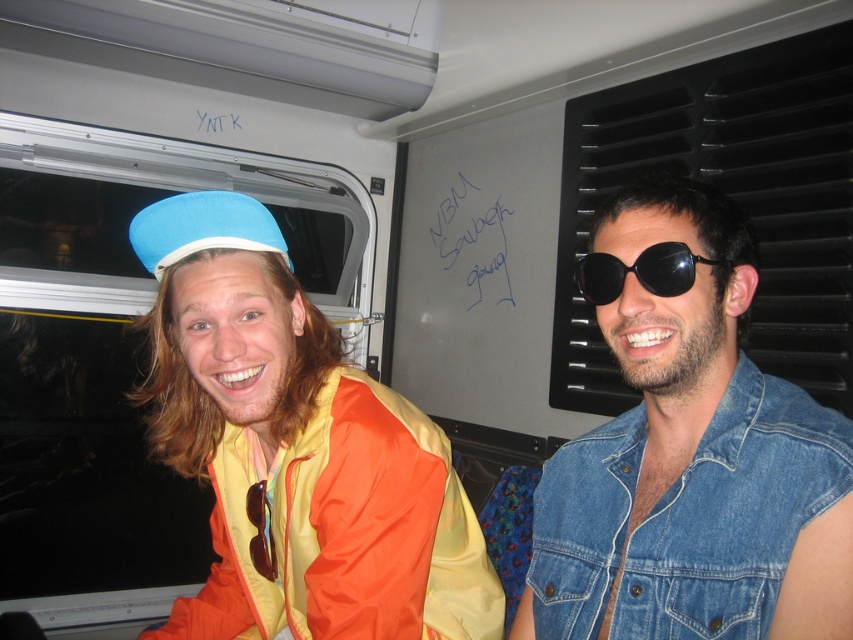
You are a passenger in the vehicle and need to locate the exact position of the point with coordinates (296, 449). Based on the scene description, which object does this point lie on?

The point with coordinates (296, 449) lies on the matte blue hat at left.

You are designing a display case for a fashion exhibition. The case needs to accommodate both the matte blue fabric hat at left and the black reflective sunglasses at right. If the case has a width limit of 10 cm, can both items fit side by side without overlapping?

The matte blue fabric hat at left is wider than the black reflective sunglasses at right. Since the case has a 10 cm width limit, we need to know the exact widths of both items to determine if they can fit together. However, the description only states that the hat is wider than the sunglasses, not their specific measurements. Therefore, it is impossible to confirm if both items will fit within the 10 cm limit based on the provided information.